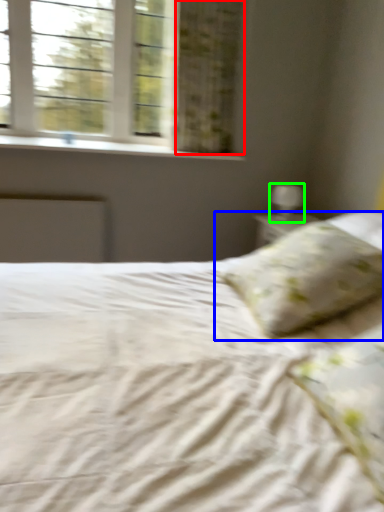
Question: Considering the real-world distances, which object is closest to curtain (highlighted by a red box)? pillow (highlighted by a blue box) or table lamp (highlighted by a green box).

Choices:
 (A) pillow
 (B) table lamp

Answer: (B)